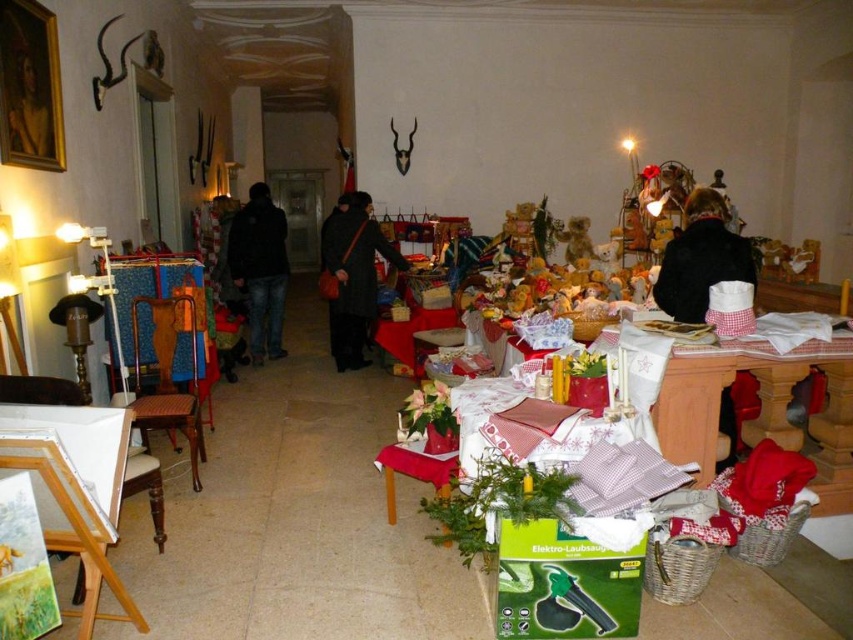
Question: Does red checkered tablecloth at lower right appear on the right side of dark blue jeans at center?

Choices:
 (A) no
 (B) yes

Answer: (B)

Question: Which point is farther to the camera?

Choices:
 (A) red checkered tablecloth at lower right
 (B) black woolen coat at right
 (C) dark wool coat at center
 (D) dark blue jeans at center

Answer: (D)

Question: Is dark wool coat at center thinner than dark blue jeans at center?

Choices:
 (A) yes
 (B) no

Answer: (B)

Question: Which object is the farthest from the dark blue jeans at center?

Choices:
 (A) black woolen coat at right
 (B) red checkered tablecloth at lower right
 (C) dark wool coat at center

Answer: (B)

Question: Can you confirm if red checkered tablecloth at lower right is bigger than dark wool coat at center?

Choices:
 (A) no
 (B) yes

Answer: (A)

Question: Estimate the real-world distances between objects in this image. Which object is farther from the dark wool coat at center?

Choices:
 (A) red checkered tablecloth at lower right
 (B) black woolen coat at right

Answer: (A)